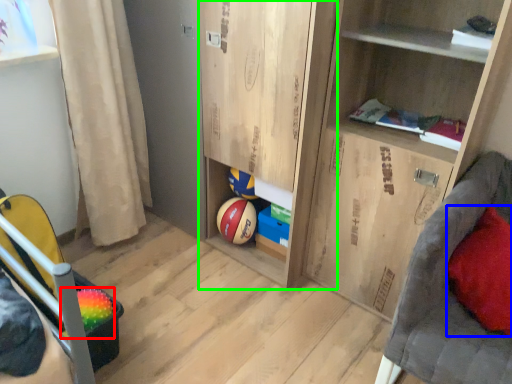
Question: Which object is the closest to the basketball (highlighted by a red box)? Choose among these: pillow (highlighted by a blue box) or cabinet (highlighted by a green box).

Choices:
 (A) pillow
 (B) cabinet

Answer: (B)